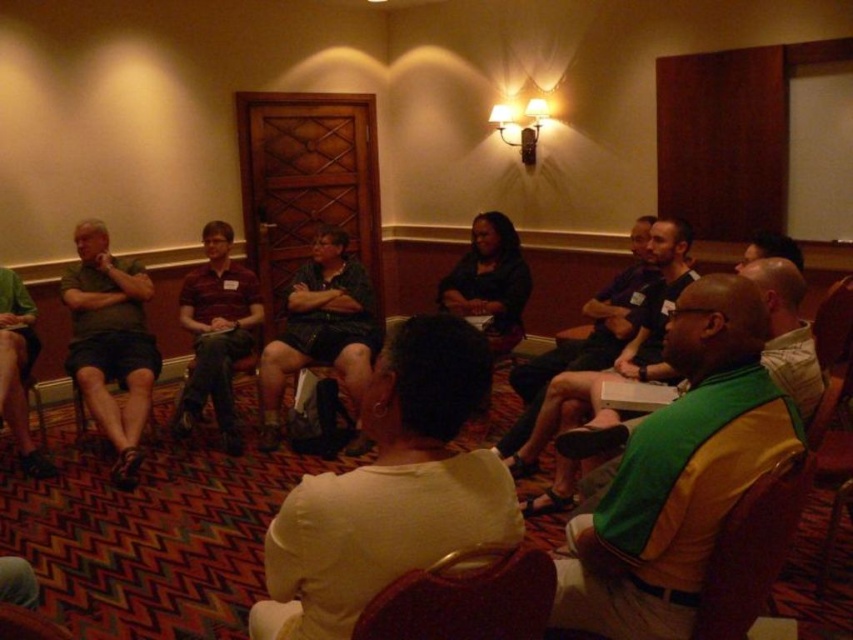
Consider the image. You are standing at point A located at coordinates point A at (346, 300). You need to walk to point B, which is 13.88 feet away. Is this distance within a typical walking distance for a short meeting in a conference room?

The distance between point A at (346, 300) and point B is 13.88 feet, which is approximately 4.2 meters. In most conference rooms, this distance is reasonable for moving between seating areas or approaching a presentation area, so it is within typical walking distance for a short meeting.